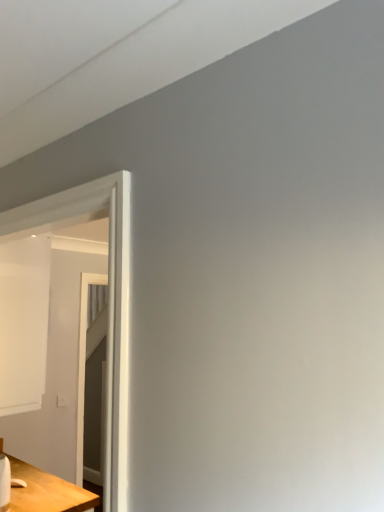
Question: Can white glossy door at left be found inside wooden table at lower left?

Choices:
 (A) yes
 (B) no

Answer: (B)

Question: From the image's perspective, would you say wooden table at lower left is positioned over white glossy door at left?

Choices:
 (A) no
 (B) yes

Answer: (A)

Question: Does wooden table at lower left have a lesser width compared to white glossy door at left?

Choices:
 (A) yes
 (B) no

Answer: (B)

Question: Would you consider wooden table at lower left to be distant from white glossy door at left?

Choices:
 (A) yes
 (B) no

Answer: (A)

Question: From a real-world perspective, does wooden table at lower left sit lower than white glossy door at left?

Choices:
 (A) yes
 (B) no

Answer: (A)

Question: Is wooden table at lower left positioned with its back to white glossy door at left?

Choices:
 (A) no
 (B) yes

Answer: (A)

Question: Is white glossy door at left thinner than wooden table at lower left?

Choices:
 (A) yes
 (B) no

Answer: (A)

Question: Is white glossy door at left taller than wooden table at lower left?

Choices:
 (A) yes
 (B) no

Answer: (A)

Question: Is white glossy door at left next to wooden table at lower left?

Choices:
 (A) yes
 (B) no

Answer: (B)

Question: From the image's perspective, does white glossy door at left appear higher than wooden table at lower left?

Choices:
 (A) no
 (B) yes

Answer: (B)

Question: Is the position of white glossy door at left less distant than that of wooden table at lower left?

Choices:
 (A) yes
 (B) no

Answer: (A)

Question: Considering the relative positions of white glossy door at left and wooden table at lower left in the image provided, is white glossy door at left to the left of wooden table at lower left from the viewer's perspective?

Choices:
 (A) no
 (B) yes

Answer: (A)

Question: From a real-world perspective, is wooden table at lower left physically located above or below white glossy door at left?

Choices:
 (A) above
 (B) below

Answer: (B)